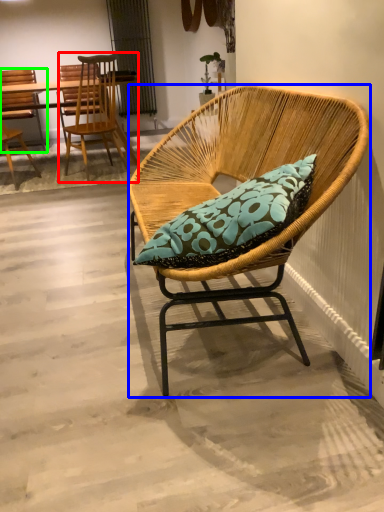
Question: Based on their relative distances, which object is nearer to chair (highlighted by a red box)? Choose from chair (highlighted by a blue box) and chair (highlighted by a green box).

Choices:
 (A) chair
 (B) chair

Answer: (B)